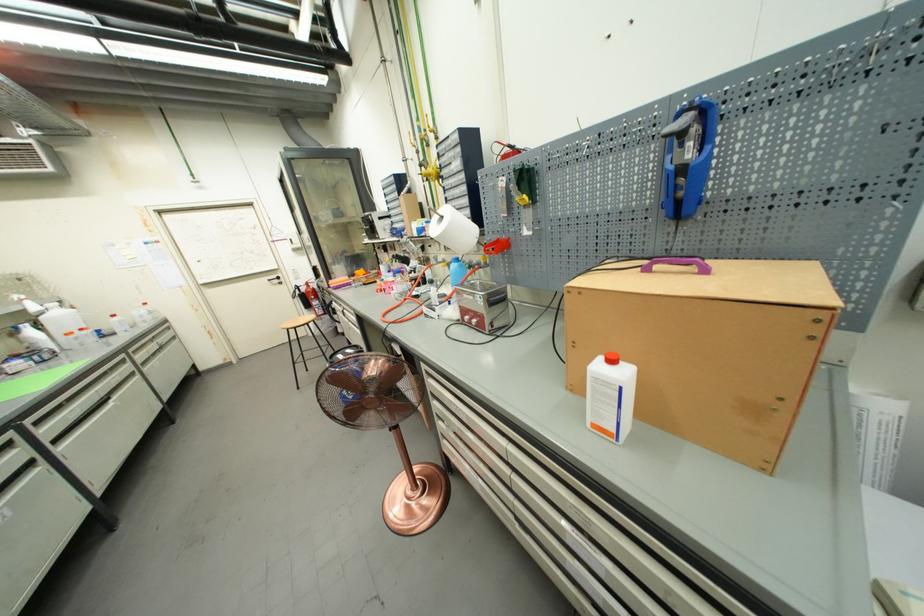
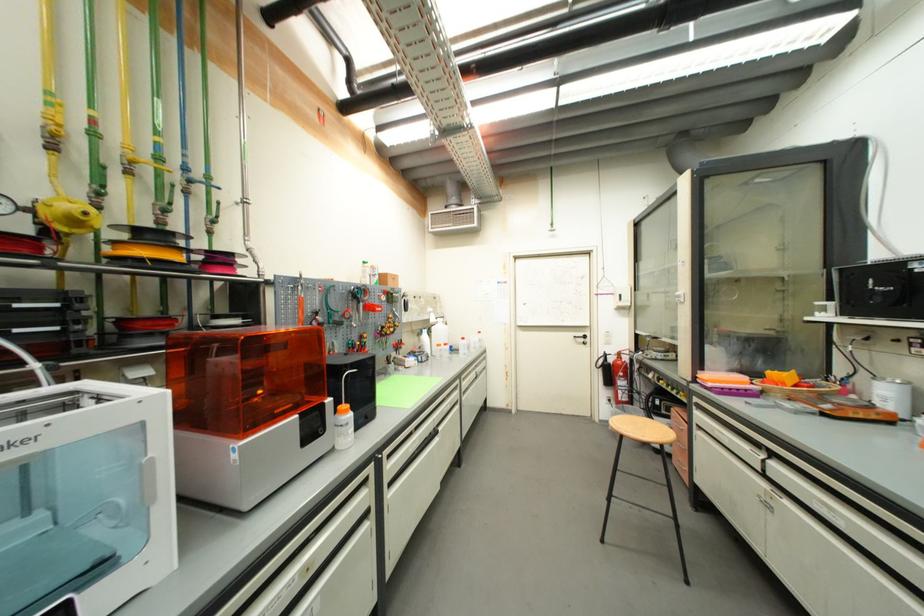
In the second image, find the point that corresponds to the point at 358,280 in the first image.

(761, 383)